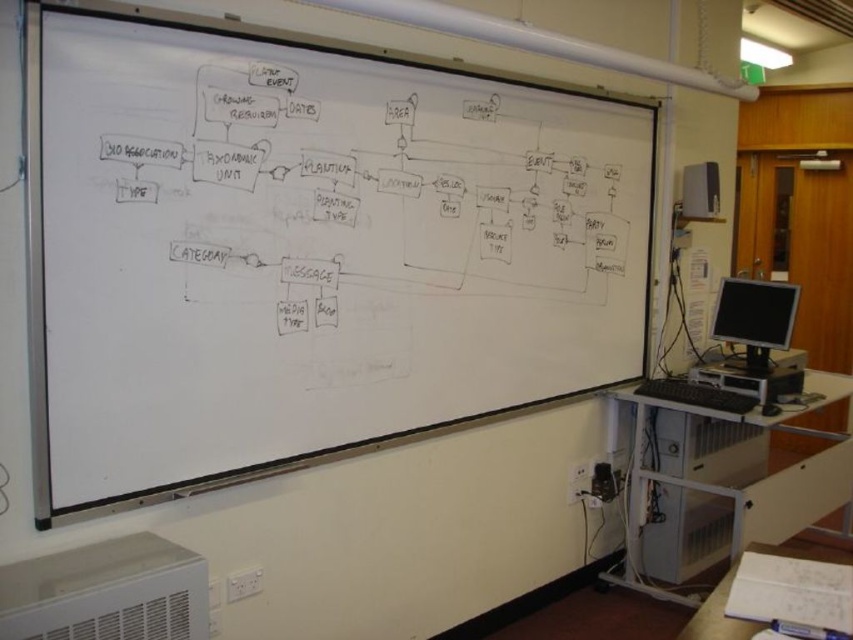
Question: Estimate the real-world distances between objects in this image. Which object is closer to the white matte board at center?

Choices:
 (A) white paper at lower right
 (B) black glossy monitor at right
 (C) metallic gray computer tower at lower right

Answer: (B)

Question: Is white matte board at center thinner than black glossy monitor at right?

Choices:
 (A) no
 (B) yes

Answer: (A)

Question: Which object is farther from the camera taking this photo?

Choices:
 (A) black glossy monitor at right
 (B) metallic gray computer tower at lower right
 (C) white matte board at center

Answer: (A)

Question: Considering the relative positions of metallic gray computer tower at lower right and white paper at lower right in the image provided, where is metallic gray computer tower at lower right located with respect to white paper at lower right?

Choices:
 (A) right
 (B) left

Answer: (A)

Question: Is the position of metallic gray computer tower at lower right more distant than that of black glossy monitor at right?

Choices:
 (A) no
 (B) yes

Answer: (A)

Question: Which point is closer to the camera?

Choices:
 (A) black glossy monitor at right
 (B) white paper at lower right
 (C) white matte board at center
 (D) metallic gray computer tower at lower right

Answer: (B)